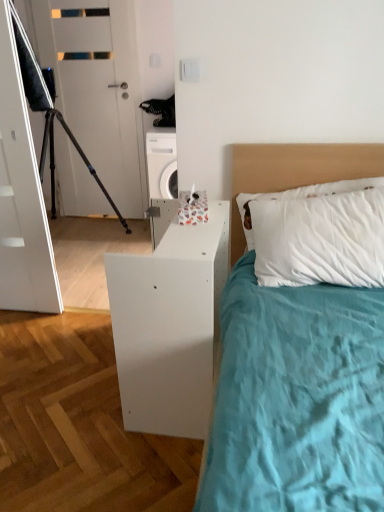
Question: From a real-world perspective, is white matte door at upper left over white matte nightstand at lower right?

Choices:
 (A) yes
 (B) no

Answer: (A)

Question: Is white matte door at upper left in front of white matte nightstand at lower right?

Choices:
 (A) no
 (B) yes

Answer: (A)

Question: Is white matte door at upper left placed right next to white matte nightstand at lower right?

Choices:
 (A) no
 (B) yes

Answer: (A)

Question: Can you confirm if white matte door at upper left is shorter than white matte nightstand at lower right?

Choices:
 (A) no
 (B) yes

Answer: (A)

Question: Considering the relative sizes of white matte door at upper left and white matte nightstand at lower right in the image provided, is white matte door at upper left taller than white matte nightstand at lower right?

Choices:
 (A) no
 (B) yes

Answer: (B)

Question: Is white matte nightstand at lower right bigger or smaller than black matte tripod at left?

Choices:
 (A) small
 (B) big

Answer: (A)

Question: In terms of width, does white matte nightstand at lower right look wider or thinner when compared to black matte tripod at left?

Choices:
 (A) wide
 (B) thin

Answer: (B)

Question: Is white matte nightstand at lower right to the left or to the right of black matte tripod at left in the image?

Choices:
 (A) right
 (B) left

Answer: (A)

Question: Relative to black matte tripod at left, is white matte nightstand at lower right in front or behind?

Choices:
 (A) front
 (B) behind

Answer: (A)

Question: From a real-world perspective, is white matte nightstand at lower right physically located above or below white matte door at upper left?

Choices:
 (A) above
 (B) below

Answer: (B)

Question: Is white matte nightstand at lower right in front of or behind white matte door at upper left in the image?

Choices:
 (A) front
 (B) behind

Answer: (A)

Question: From the image's perspective, is white matte nightstand at lower right above or below white matte door at upper left?

Choices:
 (A) above
 (B) below

Answer: (B)

Question: Does point (160, 245) appear closer or farther from the camera than point (69, 67)?

Choices:
 (A) farther
 (B) closer

Answer: (B)

Question: Looking at their shapes, would you say white matte door at upper left is wider or thinner than white matte headboard at upper right?

Choices:
 (A) wide
 (B) thin

Answer: (B)

Question: Is white matte door at upper left taller or shorter than white matte headboard at upper right?

Choices:
 (A) tall
 (B) short

Answer: (A)